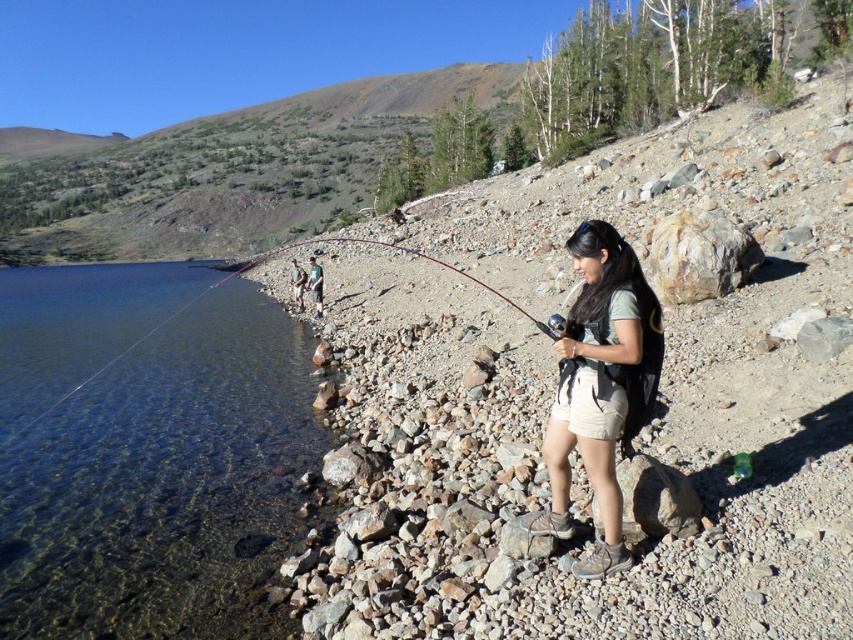
Question: Does clear water at lake left have a larger size compared to green fabric shirt at center?

Choices:
 (A) yes
 (B) no

Answer: (A)

Question: Estimate the real-world distances between objects in this image. Which object is farther from the green fabric backpack at center?

Choices:
 (A) clear water at lake left
 (B) matte gray shirt at center

Answer: (B)

Question: Based on their relative distances, which object is nearer to the green fabric backpack at center?

Choices:
 (A) clear water at lake left
 (B) matte gray shirt at center
 (C) green fabric shirt at center

Answer: (C)

Question: Which is nearer to the clear water at lake left?

Choices:
 (A) matte gray shirt at center
 (B) green fabric backpack at center

Answer: (B)

Question: Does clear water at lake left lie behind matte gray shirt at center?

Choices:
 (A) yes
 (B) no

Answer: (A)

Question: Can you confirm if green fabric backpack at center is wider than green fabric shirt at center?

Choices:
 (A) no
 (B) yes

Answer: (A)